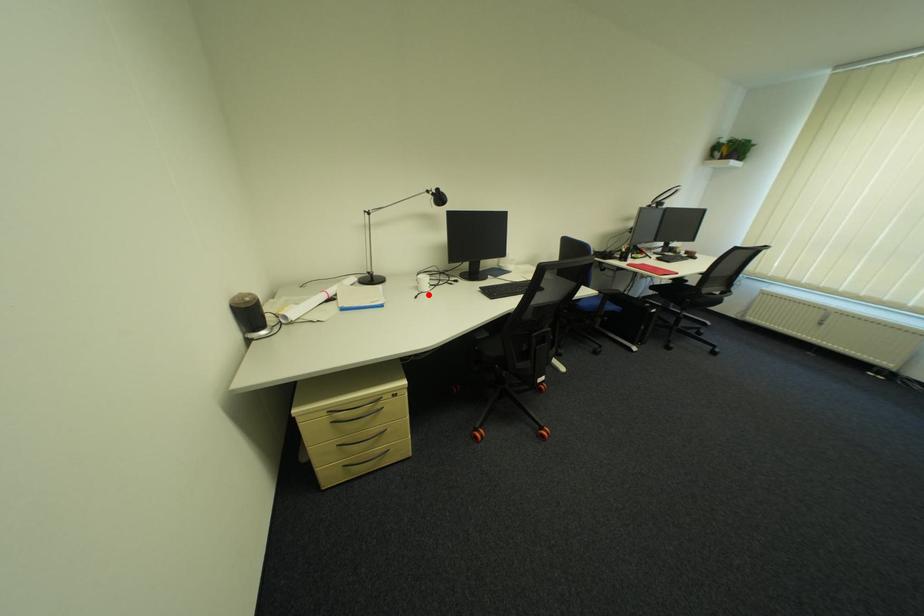
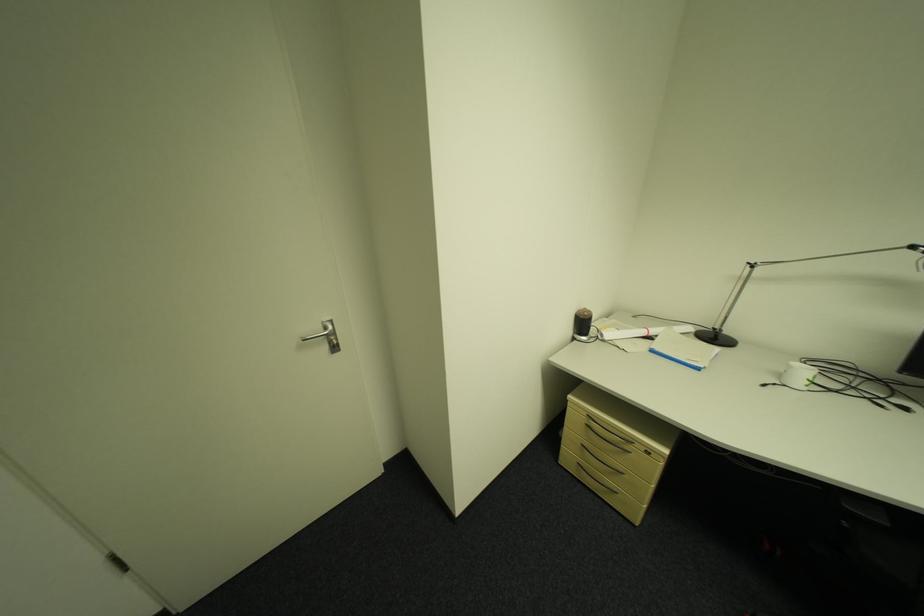
Locate, in the second image, the point that corresponds to the highlighted location in the first image.

(784, 386)